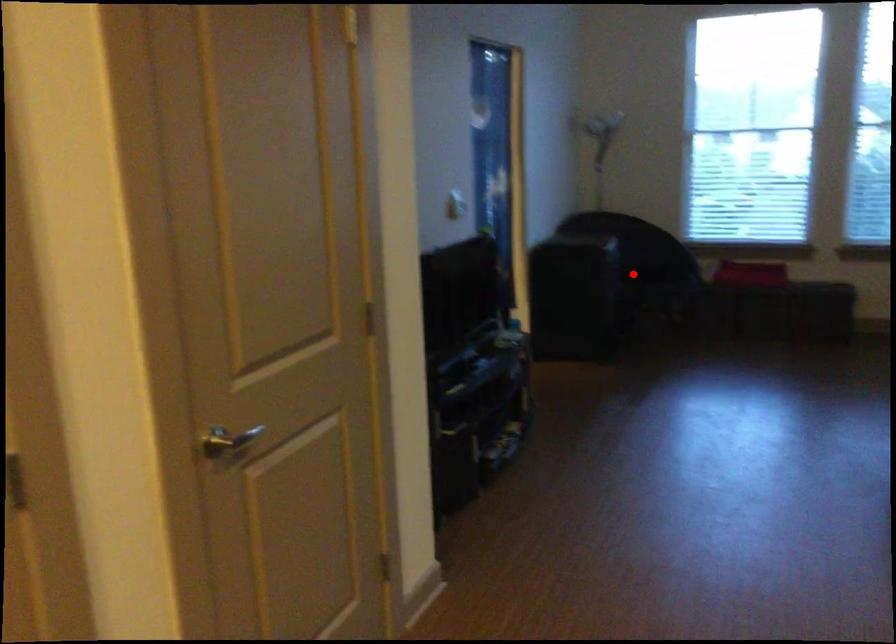
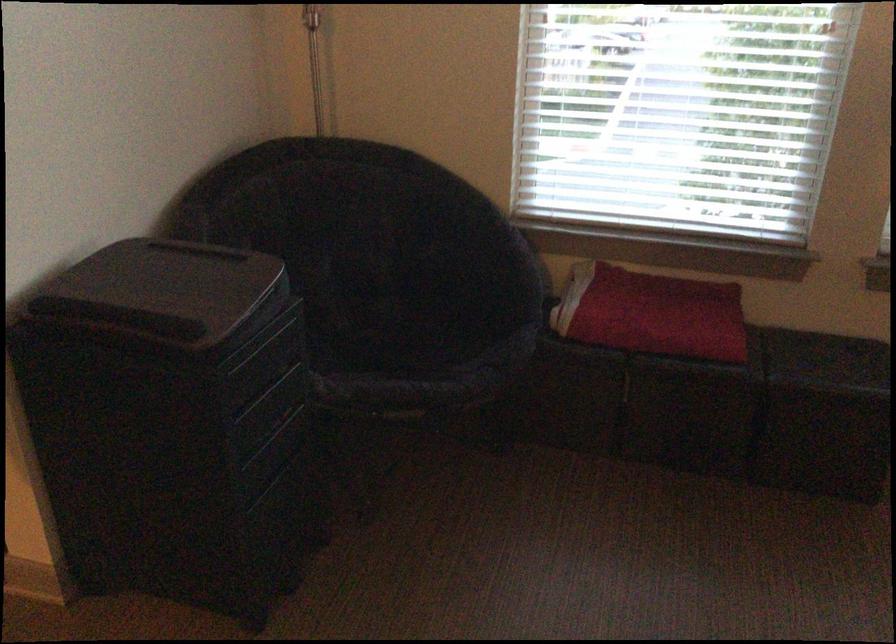
Question: I am providing you with two images of the same scene from different viewpoints. A red point is shown in image1. For the corresponding object point in image2, is it positioned nearer or farther from the camera?

Choices:
 (A) Nearer
 (B) Farther

Answer: (A)